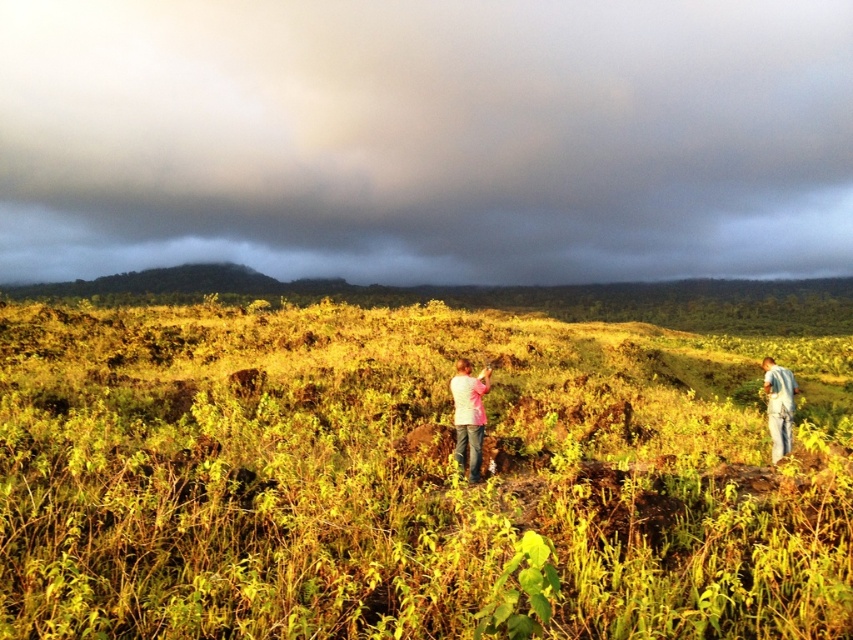
Is dark gray cloud at upper center to the left of blue jeans at lower right from the viewer's perspective?

Yes, dark gray cloud at upper center is to the left of blue jeans at lower right.

Is dark gray cloud at upper center positioned in front of blue jeans at lower right?

No, it is behind blue jeans at lower right.

The height and width of the screenshot is (640, 853). What do you see at coordinates (427, 138) in the screenshot? I see `dark gray cloud at upper center` at bounding box center [427, 138].

This screenshot has width=853, height=640. In order to click on dark gray cloud at upper center in this screenshot , I will do `click(427, 138)`.

Is pink fabric at center above blue jeans at lower right?

Actually, pink fabric at center is below blue jeans at lower right.

Which is in front, point (456, 401) or point (770, 376)?

Positioned in front is point (456, 401).

Which is behind, point (465, 369) or point (787, 429)?

The point (787, 429) is more distant.

Image resolution: width=853 pixels, height=640 pixels. Identify the location of pink fabric at center. (468, 416).

Who is lower down, dark gray cloud at upper center or pink fabric at center?

pink fabric at center is lower down.

Is dark gray cloud at upper center in front of pink fabric at center?

No, it is behind pink fabric at center.

Who is more distant from viewer, [575,68] or [466,387]?

Point [575,68]

This screenshot has height=640, width=853. I want to click on dark gray cloud at upper center, so pyautogui.click(x=427, y=138).